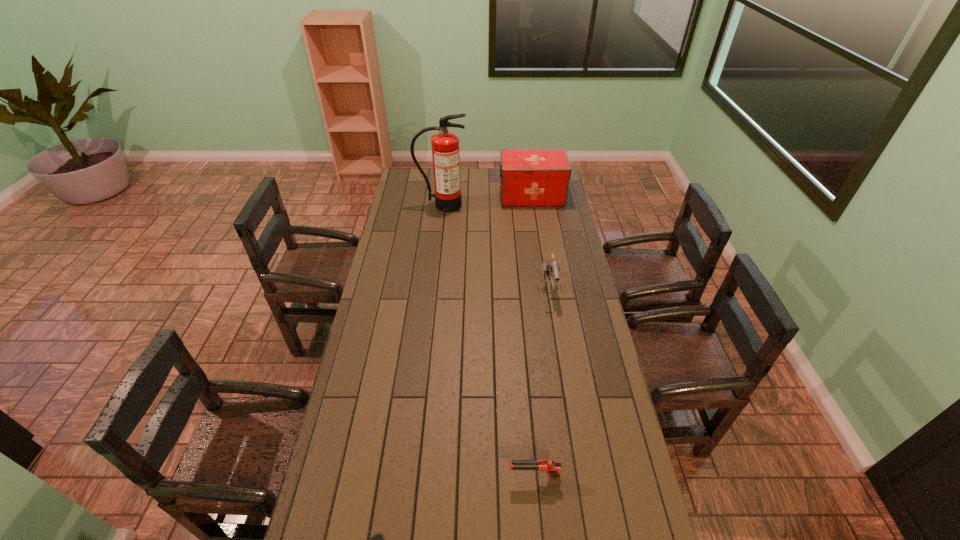
Where is `the tallest object`? The width and height of the screenshot is (960, 540). the tallest object is located at coordinates (445, 145).

Identify the location of the fourth shortest object. (528, 177).

Locate an element on the screen. This screenshot has width=960, height=540. the third shortest object is located at coordinates (551, 266).

You are a GUI agent. You are given a task and a screenshot of the screen. Output one action in this format:
    pyautogui.click(x=<x>, y=<y>)
    Task: Click on the taller gun
    
    Given the screenshot: What is the action you would take?
    pyautogui.click(x=551, y=266)

You are a GUI agent. You are given a task and a screenshot of the screen. Output one action in this format:
    pyautogui.click(x=<x>, y=<y>)
    Task: Click on the fourth farthest object
    
    Given the screenshot: What is the action you would take?
    click(552, 468)

Where is `the nearer gun`? the nearer gun is located at coordinates (552, 468).

This screenshot has height=540, width=960. What are the coordinates of `free space located 0.300m on the front-facing side of the tallest object` in the screenshot? It's located at (437, 249).

In order to click on free space located on the handle side of the fourth shortest object in this screenshot , I will do point(477,196).

This screenshot has height=540, width=960. Identify the location of free space located on the handle side of the fourth shortest object. (469, 196).

The width and height of the screenshot is (960, 540). What are the coordinates of `vacant space located 0.110m on the handle side of the fourth shortest object` in the screenshot? It's located at (479, 196).